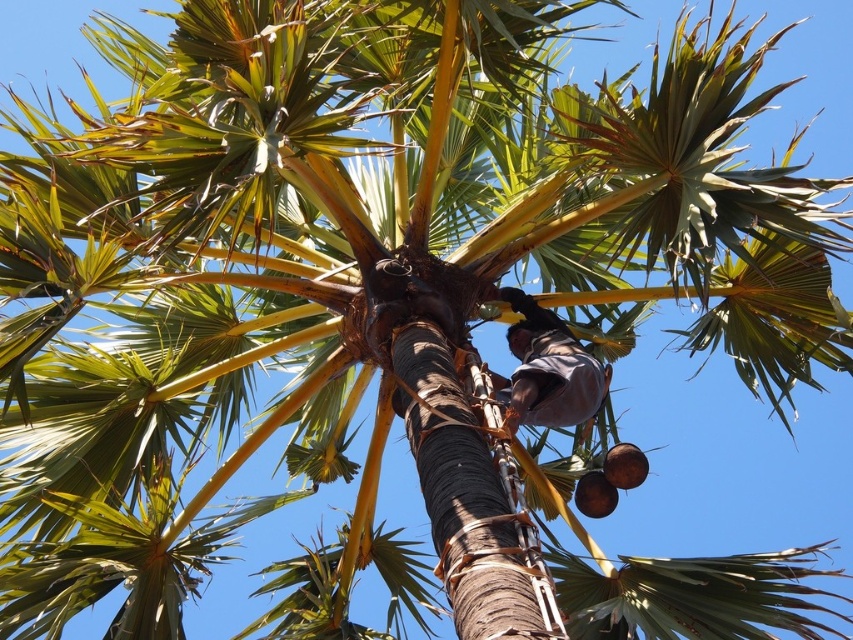
Question: Which is nearer to the brown rough coconut at lower right?

Choices:
 (A) brown matte coconut at lower right
 (B) brown fabric at center

Answer: (A)

Question: In this image, where is brown rough coconut at lower right located relative to brown matte coconut at lower right?

Choices:
 (A) right
 (B) left

Answer: (A)

Question: Can you confirm if brown rough coconut at lower right is positioned to the left of brown matte coconut at lower right?

Choices:
 (A) no
 (B) yes

Answer: (A)

Question: Can you confirm if brown fabric at center is wider than brown matte coconut at lower right?

Choices:
 (A) no
 (B) yes

Answer: (B)

Question: Which of the following is the closest to the observer?

Choices:
 (A) brown matte coconut at lower right
 (B) brown rough coconut at lower right

Answer: (B)

Question: Considering the real-world distances, which object is closest to the brown rough coconut at lower right?

Choices:
 (A) brown fabric at center
 (B) brown matte coconut at lower right

Answer: (B)